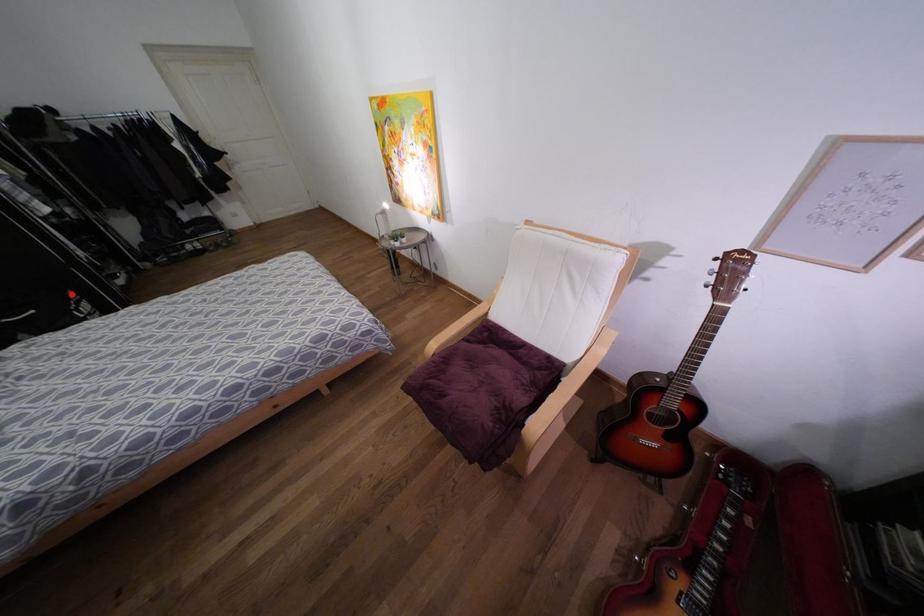
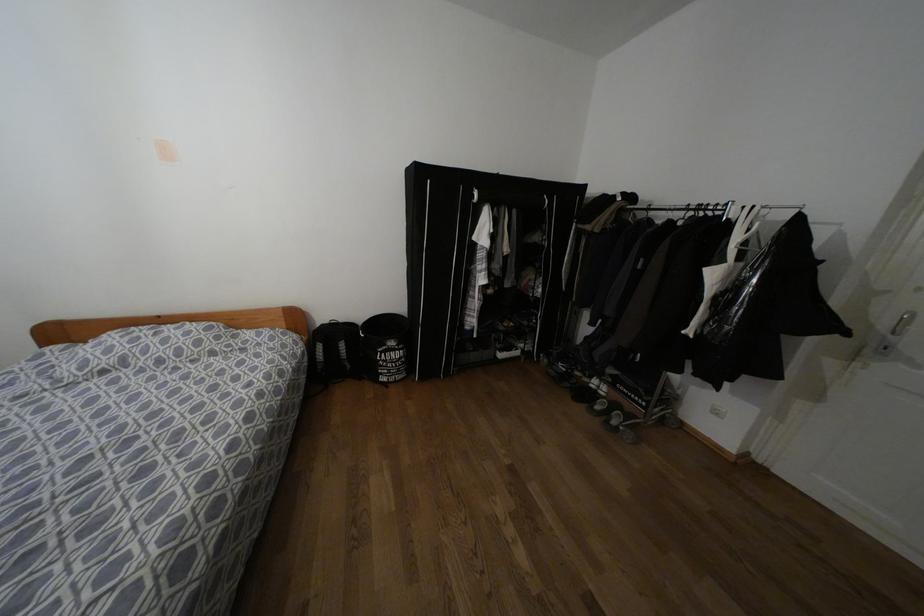
Question: A red point is marked in image1. In image2, is the corresponding 3D point closer to the camera or farther? Reply with the corresponding letter.

Choices:
 (A) The corresponding 3D point is closer.
 (B) The corresponding 3D point is farther.

Answer: (A)